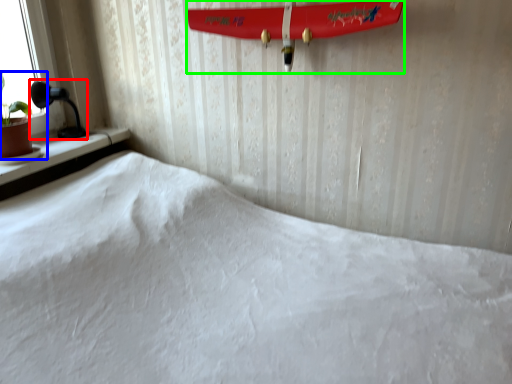
Question: Based on their relative distances, which object is nearer to table lamp (highlighted by a red box)? Choose from houseplant (highlighted by a blue box) and surfboard (highlighted by a green box).

Choices:
 (A) houseplant
 (B) surfboard

Answer: (A)